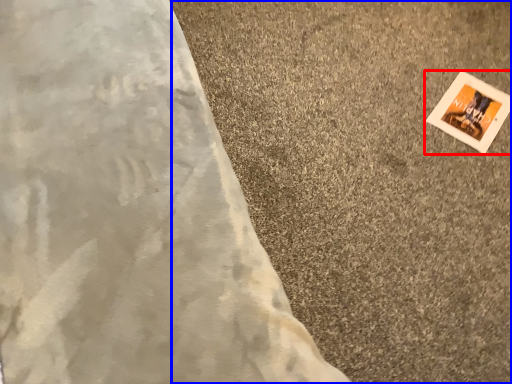
Question: Which point is further to the camera, picture frame (highlighted by a red box) or concrete (highlighted by a blue box)?

Choices:
 (A) picture frame
 (B) concrete

Answer: (A)